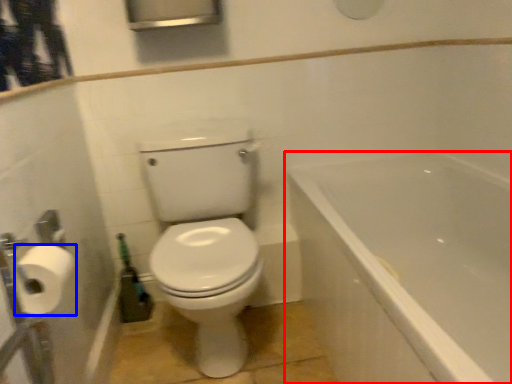
Question: Which object appears farthest to the camera in this image, bathtub (highlighted by a red box) or toilet paper (highlighted by a blue box)?

Choices:
 (A) bathtub
 (B) toilet paper

Answer: (B)